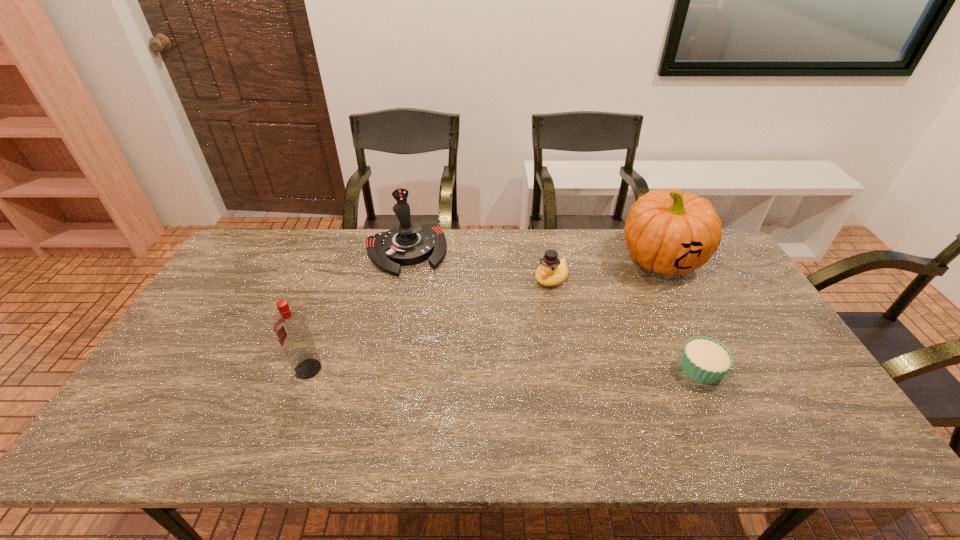
Where is `free space on the desktop that is between the vodka and the cupcake and is positioned on the handle side of the fourth object from right to left`? This screenshot has width=960, height=540. free space on the desktop that is between the vodka and the cupcake and is positioned on the handle side of the fourth object from right to left is located at coordinates (445, 369).

Identify the location of free spot on the desktop that is between the vodka and the cupcake and is positioned on the front-facing side of the second shortest object. point(447,369).

Locate an element on the screen. free space on the desktop that is between the vodka and the cupcake and is positioned on the surface of the pumpkin is located at coordinates (562, 369).